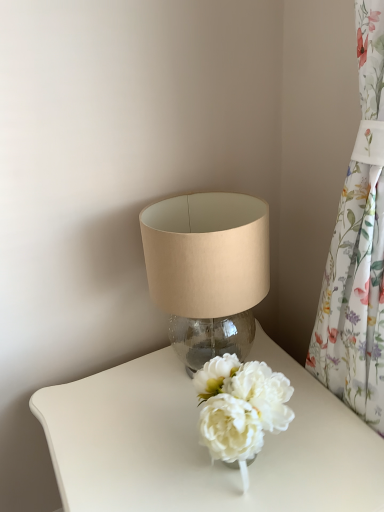
Question: Considering the positions of point (158, 270) and point (135, 498), is point (158, 270) closer or farther from the camera than point (135, 498)?

Choices:
 (A) closer
 (B) farther

Answer: (B)

Question: From their relative heights in the image, would you say translucent glass lampshade at upper center is taller or shorter than white glossy table at center?

Choices:
 (A) tall
 (B) short

Answer: (B)

Question: Which object is the closest to the floral fabric curtain at right?

Choices:
 (A) translucent glass lampshade at upper center
 (B) white glossy table at center

Answer: (A)

Question: Which object is positioned farthest from the white glossy table at center?

Choices:
 (A) floral fabric curtain at right
 (B) translucent glass lampshade at upper center

Answer: (A)